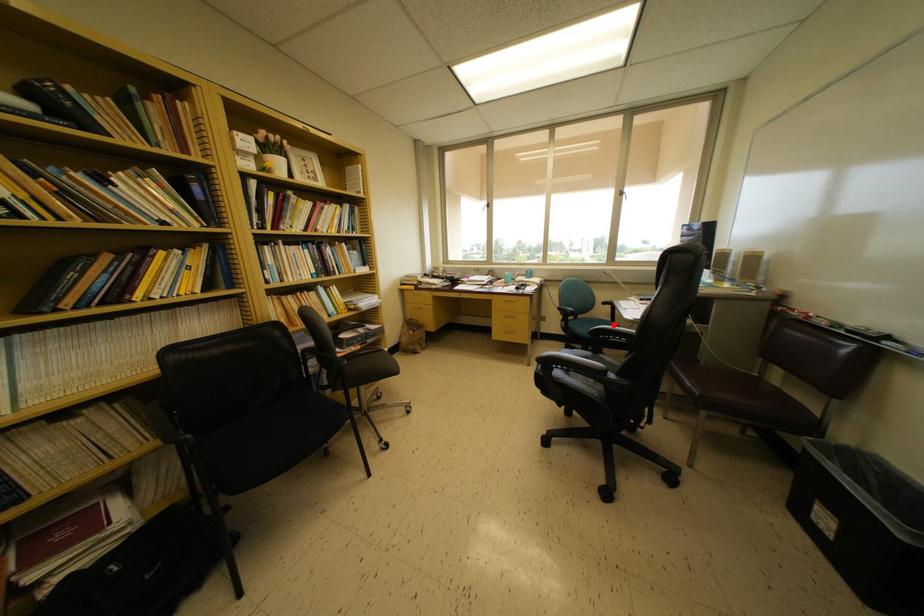
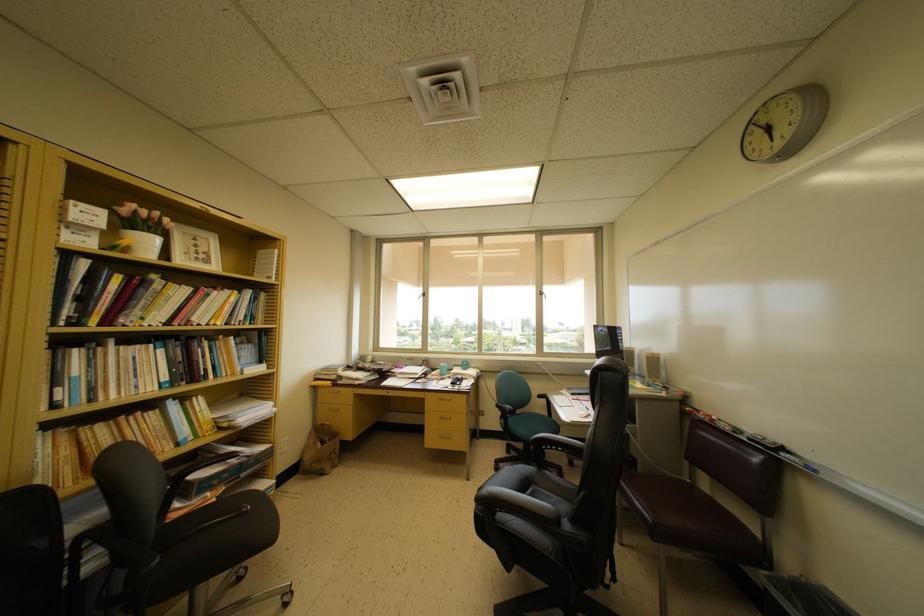
Question: I am providing you with two images of the same scene from different viewpoints. Image1 has a red point marked. In image2, the corresponding 3D location appears at what relative position? Reply with the corresponding letter.

Choices:
 (A) Closer
 (B) Farther

Answer: (B)